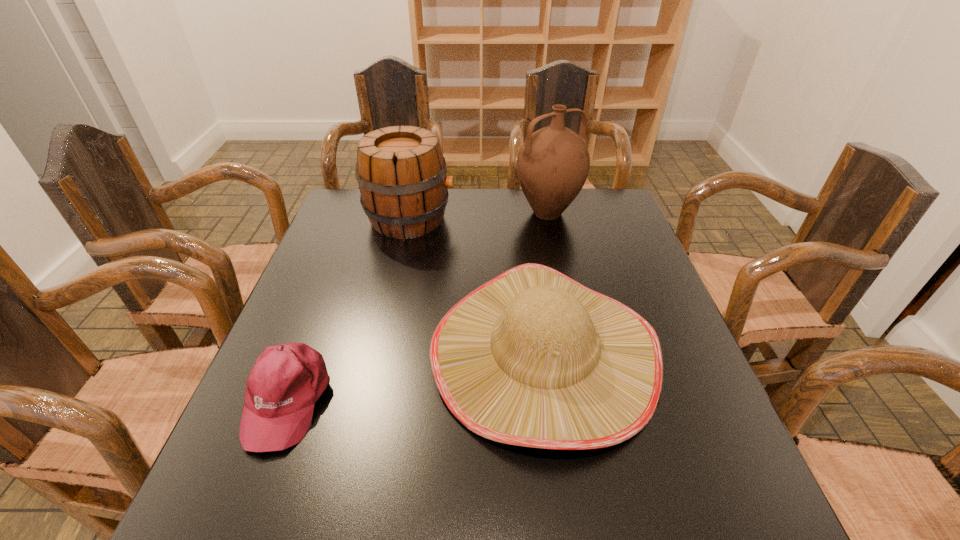
Locate an element on the screen. The height and width of the screenshot is (540, 960). pitcher is located at coordinates (553, 163).

Image resolution: width=960 pixels, height=540 pixels. I want to click on the second tallest object, so click(401, 171).

I want to click on sunhat, so pos(533,358).

At what (x,y) coordinates should I click in order to perform the action: click on baseball cap. Please return your answer as a coordinate pair (x, y). The width and height of the screenshot is (960, 540). Looking at the image, I should click on (x=287, y=380).

Find the location of a particular element. Image resolution: width=960 pixels, height=540 pixels. vacant region located 0.200m on the left of the tallest object is located at coordinates (451, 213).

This screenshot has height=540, width=960. What are the coordinates of `free space located 0.120m on the side of the cider where the spigot is located` in the screenshot? It's located at (493, 219).

At what (x,y) coordinates should I click in order to perform the action: click on free point located on the back of the sunhat. Please return your answer as a coordinate pair (x, y). The width and height of the screenshot is (960, 540). Looking at the image, I should click on (524, 210).

Locate an element on the screen. vacant space located 0.090m at the front of the shortest object with the brim is located at coordinates (246, 509).

You are a GUI agent. You are given a task and a screenshot of the screen. Output one action in this format:
    pyautogui.click(x=<x>, y=<y>)
    Task: Click on the pitcher situated at the far edge
    This screenshot has width=960, height=540.
    Given the screenshot: What is the action you would take?
    pyautogui.click(x=553, y=163)

Find the location of a particular element. cider that is positioned at the far edge is located at coordinates (401, 171).